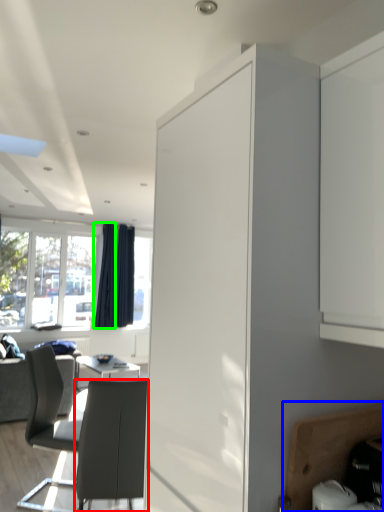
Question: Considering the real-world distances, which object is closest to chair (highlighted by a red box)? cabinetry (highlighted by a blue box) or curtain (highlighted by a green box).

Choices:
 (A) cabinetry
 (B) curtain

Answer: (A)